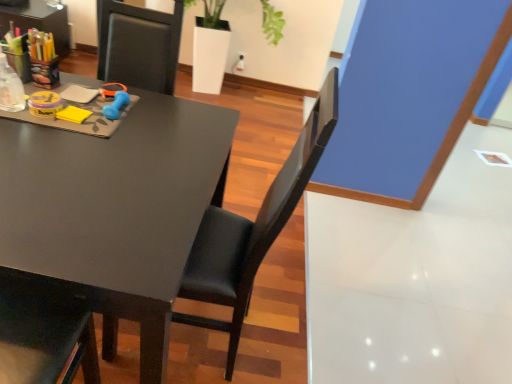
Question: Considering the relative positions of blue plastic scissors at upper center and white glossy planter at upper center in the image provided, is blue plastic scissors at upper center behind white glossy planter at upper center?

Choices:
 (A) no
 (B) yes

Answer: (A)

Question: From a real-world perspective, is blue plastic scissors at upper center under white glossy planter at upper center?

Choices:
 (A) no
 (B) yes

Answer: (A)

Question: Is blue plastic scissors at upper center facing towards white glossy planter at upper center?

Choices:
 (A) yes
 (B) no

Answer: (B)

Question: From the image's perspective, is blue plastic scissors at upper center over white glossy planter at upper center?

Choices:
 (A) yes
 (B) no

Answer: (B)

Question: Is blue plastic scissors at upper center wider than white glossy planter at upper center?

Choices:
 (A) no
 (B) yes

Answer: (A)

Question: Can you confirm if blue plastic scissors at upper center is taller than white glossy planter at upper center?

Choices:
 (A) yes
 (B) no

Answer: (B)

Question: Are white glossy planter at upper center and matte black desk at left beside each other?

Choices:
 (A) yes
 (B) no

Answer: (B)

Question: From the image's perspective, is white glossy planter at upper center on top of matte black desk at left?

Choices:
 (A) yes
 (B) no

Answer: (A)

Question: Is matte black desk at left at the back of white glossy planter at upper center?

Choices:
 (A) no
 (B) yes

Answer: (A)

Question: From a real-world perspective, is white glossy planter at upper center positioned under matte black desk at left based on gravity?

Choices:
 (A) yes
 (B) no

Answer: (B)

Question: Is white glossy planter at upper center aimed at matte black desk at left?

Choices:
 (A) no
 (B) yes

Answer: (B)

Question: From the image's perspective, is white glossy planter at upper center beneath matte black desk at left?

Choices:
 (A) yes
 (B) no

Answer: (B)

Question: Is matte black desk at left shorter than white glossy planter at upper center?

Choices:
 (A) no
 (B) yes

Answer: (B)